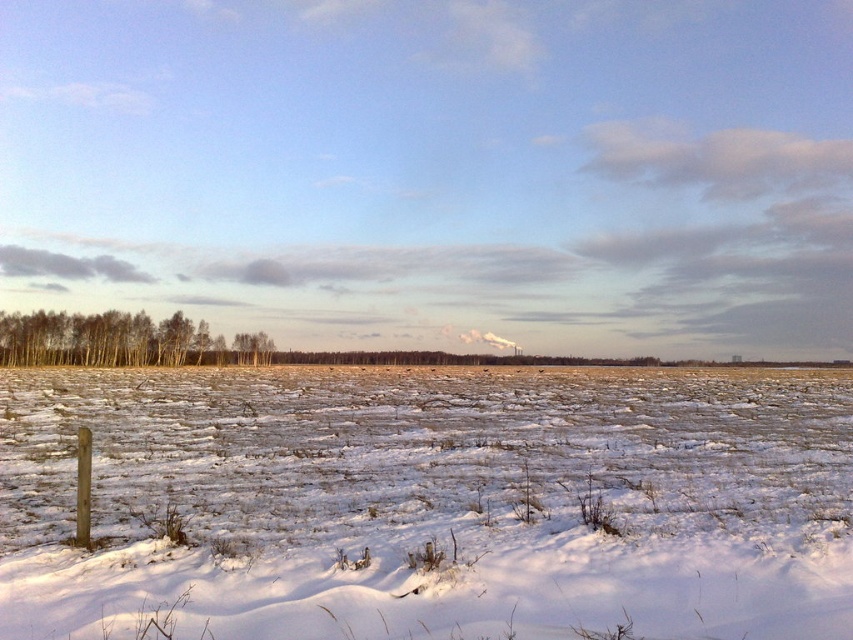
Question: Does white powdery snow at lower left lie in front of brown smooth trees at left?

Choices:
 (A) yes
 (B) no

Answer: (A)

Question: Can you confirm if white powdery snow at lower left is bigger than brown smooth trees at left?

Choices:
 (A) yes
 (B) no

Answer: (A)

Question: Where is white powdery snow at lower left located in relation to brown smooth trees at left in the image?

Choices:
 (A) above
 (B) below

Answer: (B)